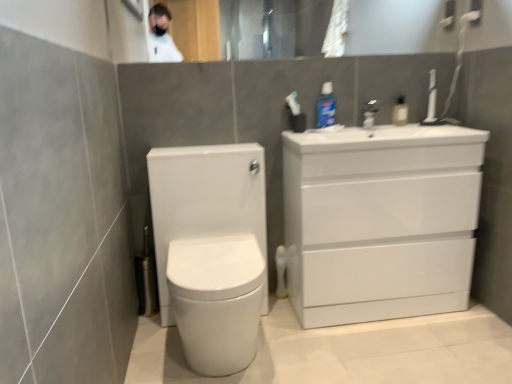
What are the coordinates of `blank space to the left of satin nickel faucet at upper center` in the screenshot? It's located at coord(348,125).